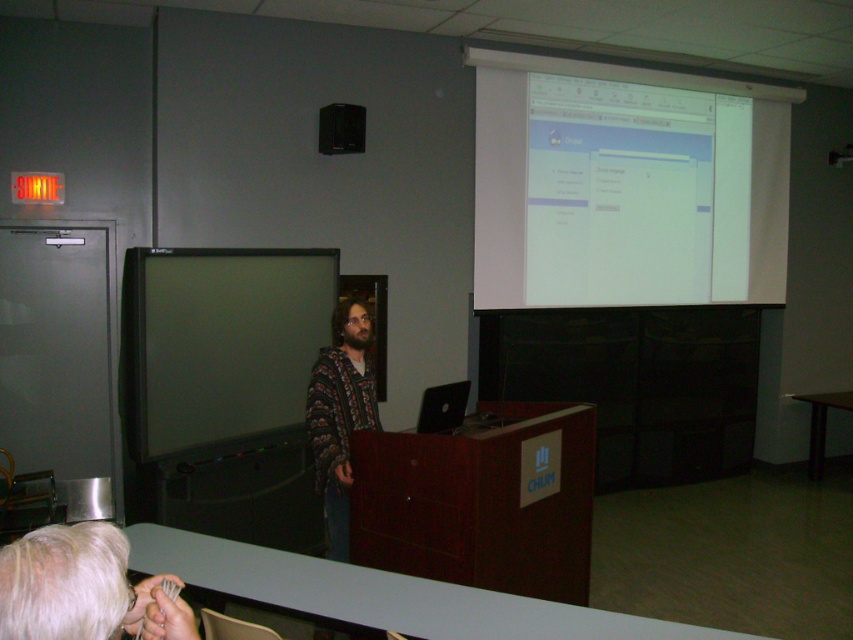
Can you confirm if blonde hair at lower left is positioned to the left of black plastic speaker at upper center?

In fact, blonde hair at lower left is to the right of black plastic speaker at upper center.

Which is below, blonde hair at lower left or black plastic speaker at upper center?

blonde hair at lower left

Identify the location of blonde hair at lower left. The image size is (853, 640). (70, 584).

This screenshot has width=853, height=640. I want to click on blonde hair at lower left, so click(x=70, y=584).

Does white glossy projector screen at upper right have a lesser width compared to matte black monitor at center?

Incorrect, white glossy projector screen at upper right's width is not less than matte black monitor at center's.

Who is more forward, (735, 102) or (202, 401)?

Point (202, 401)

Locate an element on the screen. The height and width of the screenshot is (640, 853). white glossy projector screen at upper right is located at coordinates [625, 186].

Which is more to the right, matte black monitor at center or black plastic speaker at upper center?

From the viewer's perspective, black plastic speaker at upper center appears more on the right side.

Does point (247, 323) come closer to viewer compared to point (337, 120)?

That is True.

Where is `matte black monitor at center`? matte black monitor at center is located at coordinates (219, 342).